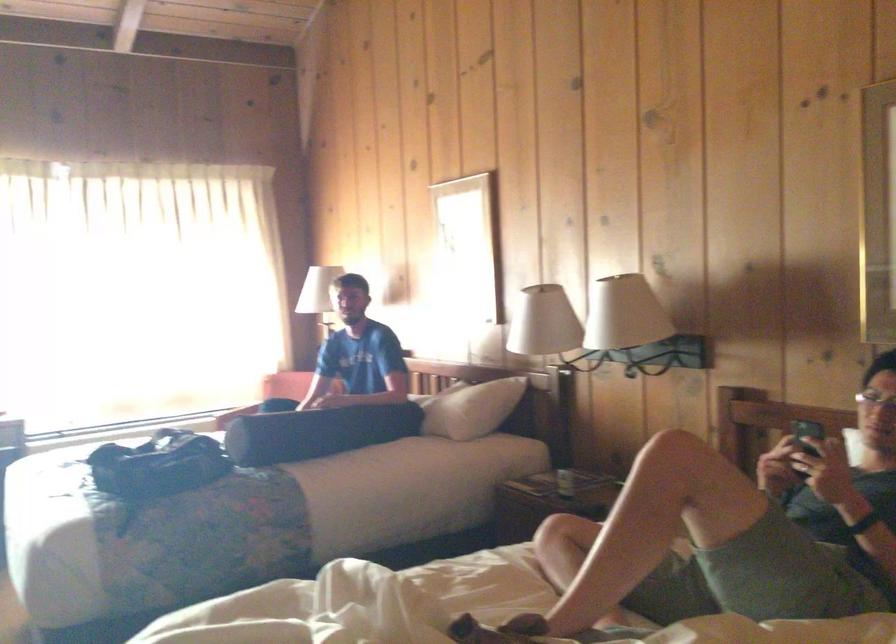
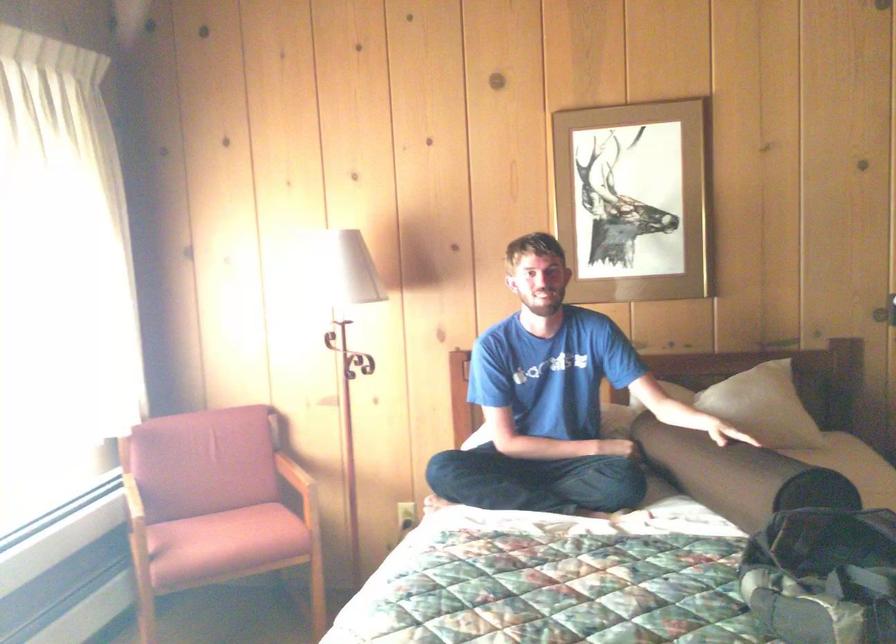
In the second image, find the point that corresponds to (264,419) in the first image.

(737, 475)